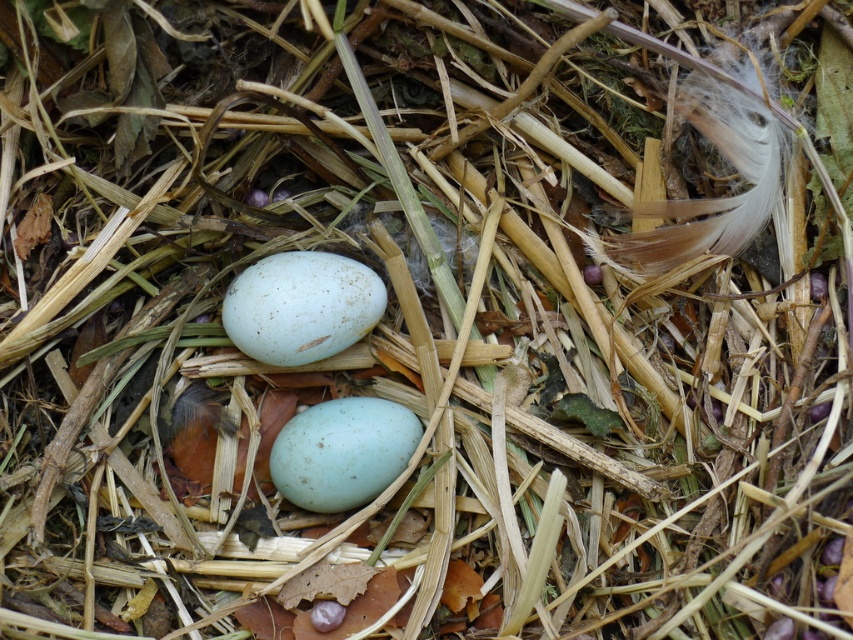
Question: Which point is closer to the camera taking this photo?

Choices:
 (A) (387, 449)
 (B) (270, 330)

Answer: (B)

Question: Considering the relative positions of speckled white egg at center and matte blue egg at center in the image provided, where is speckled white egg at center located with respect to matte blue egg at center?

Choices:
 (A) below
 (B) above

Answer: (B)

Question: Is speckled white egg at center above matte blue egg at center?

Choices:
 (A) no
 (B) yes

Answer: (B)

Question: Among these objects, which one is nearest to the camera?

Choices:
 (A) matte blue egg at center
 (B) speckled white egg at center

Answer: (B)

Question: Does speckled white egg at center have a smaller size compared to matte blue egg at center?

Choices:
 (A) yes
 (B) no

Answer: (A)